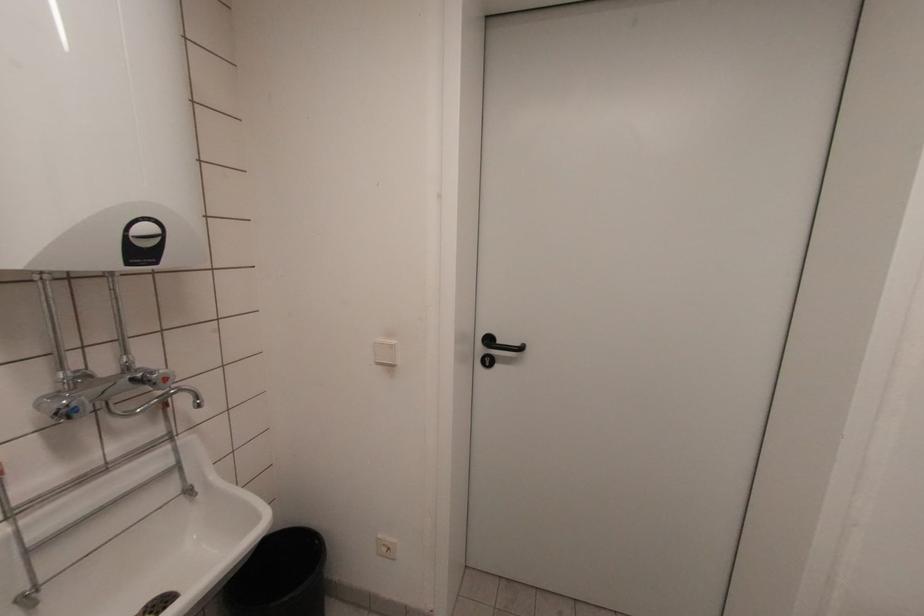
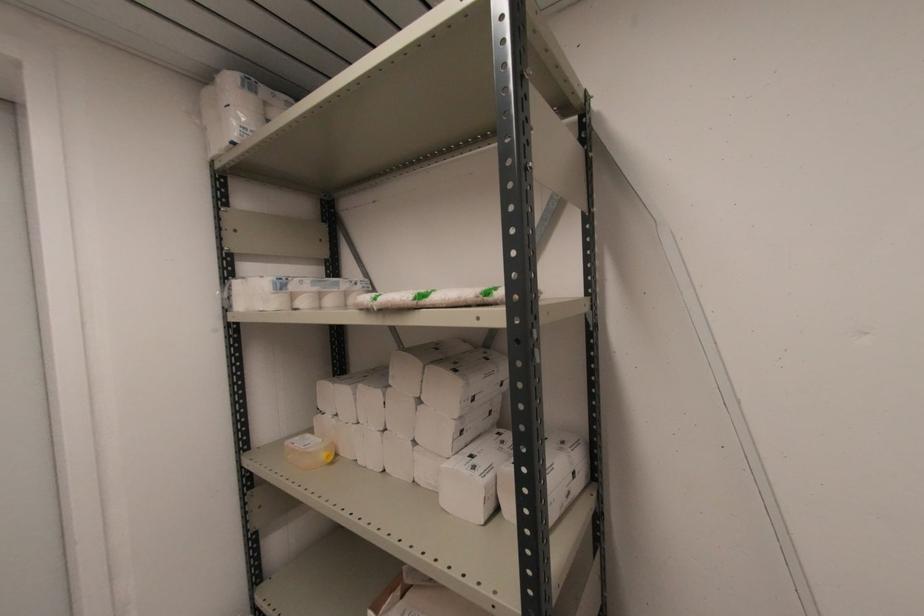
Question: The camera is either moving clockwise (left) or counter-clockwise (right) around the object. The first image is from the beginning of the video and the second image is from the end. Is the camera moving left or right when shooting the video?

Choices:
 (A) Left
 (B) Right

Answer: (A)